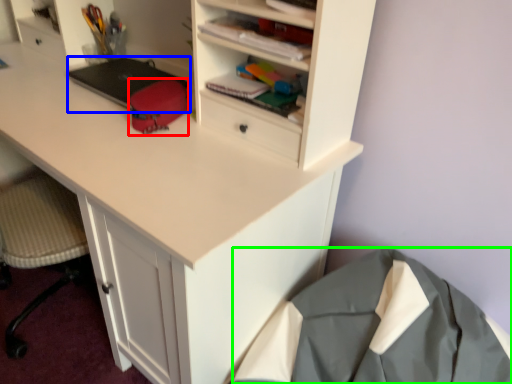
Question: Which is nearer to the stationery (highlighted by a red box)? laptop (highlighted by a blue box) or clothing (highlighted by a green box).

Choices:
 (A) laptop
 (B) clothing

Answer: (A)